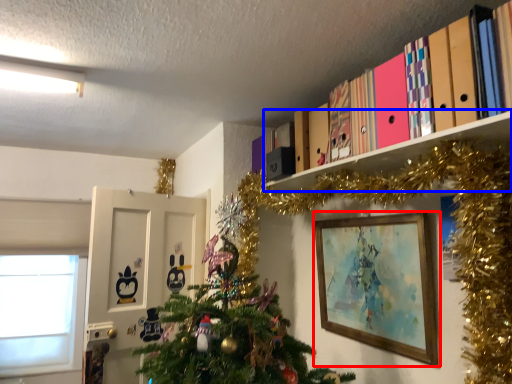
Question: Which of the following is the closest to the observer, picture frame (highlighted by a red box) or shelf (highlighted by a blue box)?

Choices:
 (A) picture frame
 (B) shelf

Answer: (B)